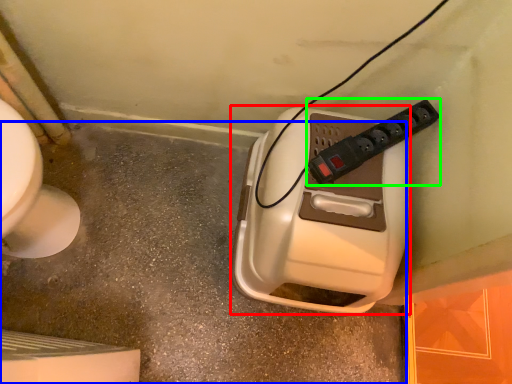
Question: Which object is positioned farthest from hand dryer (highlighted by a red box)? Select from concrete (highlighted by a blue box) and power plugs and sockets (highlighted by a green box).

Choices:
 (A) concrete
 (B) power plugs and sockets

Answer: (A)